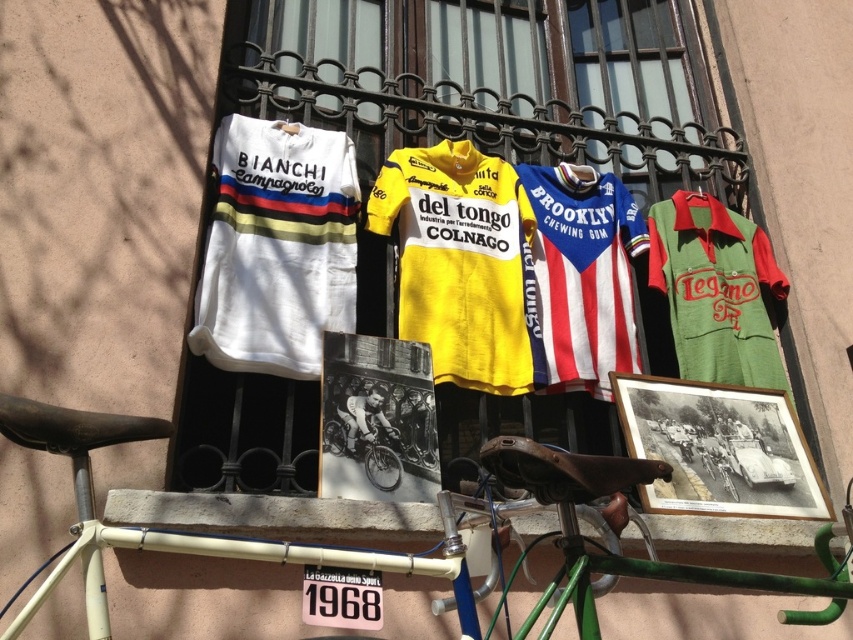
Can you confirm if white jersey at left is bigger than shiny silver bicycle at center?

Yes, white jersey at left is bigger than shiny silver bicycle at center.

What do you see at coordinates (277, 248) in the screenshot? I see `white jersey at left` at bounding box center [277, 248].

The image size is (853, 640). In order to click on white jersey at left in this screenshot , I will do `click(277, 248)`.

Is point (486, 132) positioned in front of point (590, 625)?

That is False.

Measure the distance from white jersey at upper left to white matte bicycle at lower left.

white jersey at upper left and white matte bicycle at lower left are 5.70 feet apart from each other.

The height and width of the screenshot is (640, 853). I want to click on white jersey at upper left, so click(456, 106).

Does white jersey at left appear on the left side of white matte bicycle at lower left?

Yes, white jersey at left is to the left of white matte bicycle at lower left.

Does white jersey at left appear over white matte bicycle at lower left?

Indeed, white jersey at left is positioned over white matte bicycle at lower left.

Who is more distant from viewer, (277, 305) or (180, 548)?

Positioned behind is point (277, 305).

The height and width of the screenshot is (640, 853). What are the coordinates of `white jersey at left` in the screenshot? It's located at (277, 248).